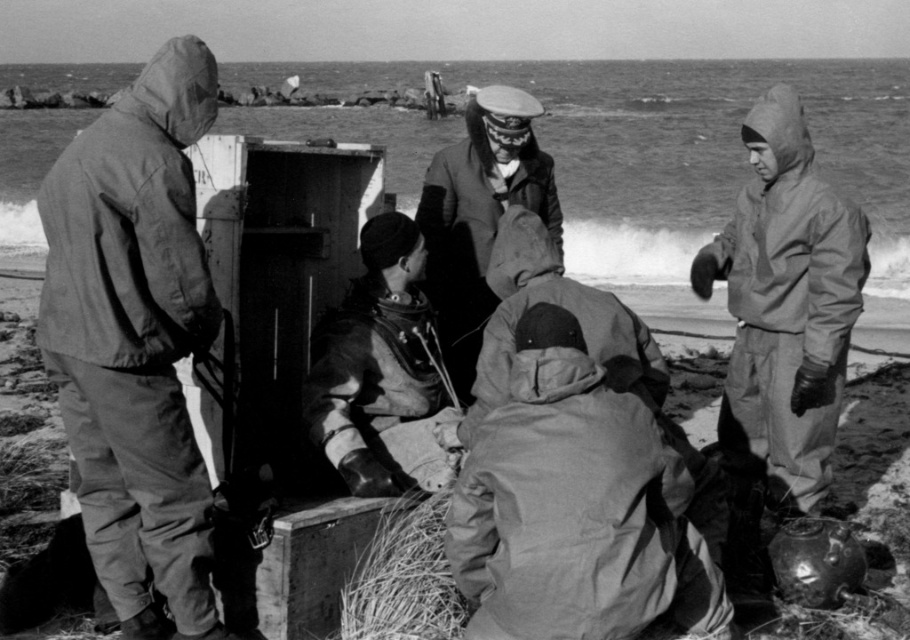
Question: Which of the following is the farthest from the observer?

Choices:
 (A) smooth leather jacket at center
 (B) fuzzy straw at lower center

Answer: (A)

Question: Which point appears farthest from the camera in this image?

Choices:
 (A) (443, 403)
 (B) (410, 620)

Answer: (A)

Question: Is matte gray jumpsuit at right bigger than leather gloves at center?

Choices:
 (A) yes
 (B) no

Answer: (A)

Question: Which point appears closest to the camera in this image?

Choices:
 (A) (794, 352)
 (B) (411, 320)

Answer: (B)

Question: In this image, where is matte khaki jacket at center located relative to matte gray jumpsuit at right?

Choices:
 (A) above
 (B) below

Answer: (B)

Question: Can you confirm if matte gray jumpsuit at right is bigger than smooth leather jacket at center?

Choices:
 (A) yes
 (B) no

Answer: (B)